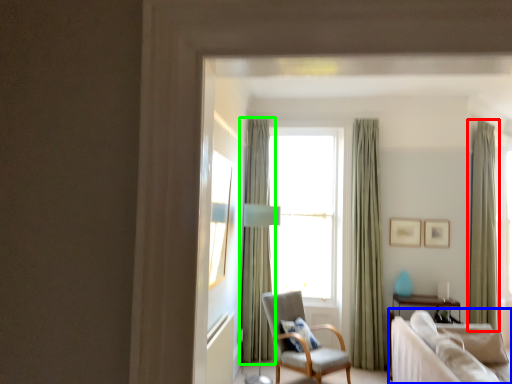
Question: Which is farther away from curtain (highlighted by a red box)? studio couch (highlighted by a blue box) or curtain (highlighted by a green box)?

Choices:
 (A) studio couch
 (B) curtain

Answer: (B)